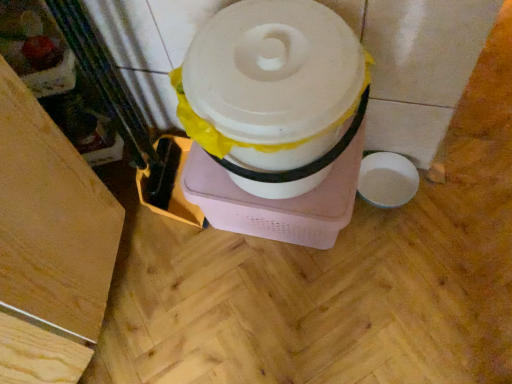
Question: In terms of height, does wooden floor at lower left look taller or shorter compared to white matte toilet paper at center?

Choices:
 (A) short
 (B) tall

Answer: (B)

Question: Is wooden floor at lower left spatially inside white matte toilet paper at center, or outside of it?

Choices:
 (A) inside
 (B) outside

Answer: (B)

Question: Relative to white matte toilet paper at center, is wooden floor at lower left in front or behind?

Choices:
 (A) front
 (B) behind

Answer: (A)

Question: In terms of size, does white matte toilet paper at center appear bigger or smaller than wooden floor at lower left?

Choices:
 (A) big
 (B) small

Answer: (B)

Question: From the image's perspective, relative to wooden floor at lower left, is white matte toilet paper at center above or below?

Choices:
 (A) above
 (B) below

Answer: (A)

Question: From a real-world perspective, is white matte toilet paper at center above or below wooden floor at lower left?

Choices:
 (A) above
 (B) below

Answer: (A)

Question: Considering the positions of white matte toilet paper at center and wooden floor at lower left in the image, is white matte toilet paper at center taller or shorter than wooden floor at lower left?

Choices:
 (A) tall
 (B) short

Answer: (B)